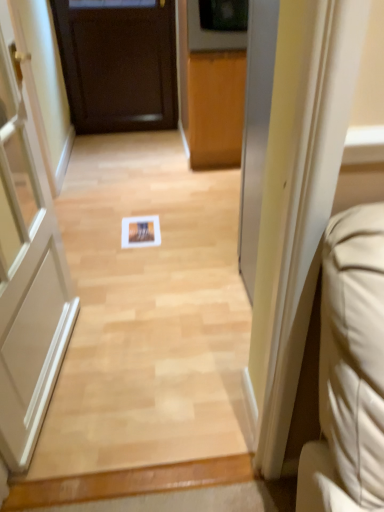
Question: Considering the positions of dark wood door at center, the second door viewed from the front, and white matte door at left, the 2th door viewed from the back, in the image, is dark wood door at center, the second door viewed from the front, taller or shorter than white matte door at left, the 2th door viewed from the back,?

Choices:
 (A) short
 (B) tall

Answer: (A)

Question: Is dark wood door at center, which appears as the second door when ordered from the bottom, in front of or behind white matte door at left, positioned as the 2th door in top-to-bottom order, in the image?

Choices:
 (A) behind
 (B) front

Answer: (A)

Question: Is point (92, 34) positioned closer to the camera than point (64, 276)?

Choices:
 (A) farther
 (B) closer

Answer: (A)

Question: Considering their positions, is white matte door at left, the 2th door viewed from the back, located in front of or behind dark wood door at center, the 1th door viewed from the back?

Choices:
 (A) front
 (B) behind

Answer: (A)

Question: Looking at their shapes, would you say white matte door at left, which is counted as the first door, starting from the bottom, is wider or thinner than dark wood door at center, which appears as the second door when ordered from the bottom?

Choices:
 (A) thin
 (B) wide

Answer: (B)

Question: Visually, is white matte door at left, the first door positioned from the front, positioned to the left or to the right of dark wood door at center, which appears as the second door when ordered from the bottom?

Choices:
 (A) left
 (B) right

Answer: (B)

Question: Is white matte door at left, the first door positioned from the front, situated inside dark wood door at center, which appears as the second door when ordered from the bottom, or outside?

Choices:
 (A) outside
 (B) inside

Answer: (A)